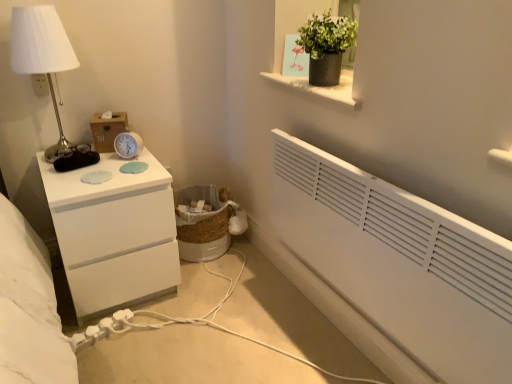
The height and width of the screenshot is (384, 512). What are the coordinates of `free space in front of white plastic alarm clock at upper left` in the screenshot? It's located at (113, 175).